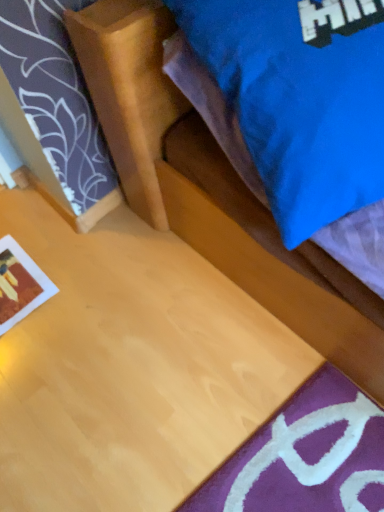
Locate an element on the screen. Image resolution: width=384 pixels, height=512 pixels. matte paper print at lower left is located at coordinates click(x=20, y=284).

What do you see at coordinates (20, 284) in the screenshot?
I see `matte paper print at lower left` at bounding box center [20, 284].

Measure the distance between matte paper print at lower left and camera.

The depth of matte paper print at lower left is 3.89 feet.

I want to click on matte blue pillow at upper right, so click(x=209, y=187).

Describe the element at coordinates (209, 187) in the screenshot. The height and width of the screenshot is (512, 384). I see `matte blue pillow at upper right` at that location.

This screenshot has width=384, height=512. I want to click on matte paper print at lower left, so click(20, 284).

Considering the positions of objects matte paper print at lower left and matte blue pillow at upper right in the image provided, who is more to the left, matte paper print at lower left or matte blue pillow at upper right?

From the viewer's perspective, matte paper print at lower left appears more on the left side.

Is matte paper print at lower left in front of or behind matte blue pillow at upper right in the image?

matte paper print at lower left is behind matte blue pillow at upper right.

Which point is more forward, (17,290) or (141,176)?

The point (141,176) is in front.

From the image's perspective, is matte paper print at lower left under matte blue pillow at upper right?

Indeed, from the image's perspective, matte paper print at lower left is shown beneath matte blue pillow at upper right.

From a real-world perspective, relative to matte blue pillow at upper right, is matte paper print at lower left vertically above or below?

Clearly, from a real-world perspective, matte paper print at lower left is below matte blue pillow at upper right.

Considering the sizes of objects matte paper print at lower left and matte blue pillow at upper right in the image provided, who is wider, matte paper print at lower left or matte blue pillow at upper right?

matte blue pillow at upper right is wider.

Who is shorter, matte paper print at lower left or matte blue pillow at upper right?

matte paper print at lower left.

Considering the sizes of matte paper print at lower left and matte blue pillow at upper right in the image, is matte paper print at lower left bigger or smaller than matte blue pillow at upper right?

Considering their sizes, matte paper print at lower left takes up less space than matte blue pillow at upper right.

Is matte paper print at lower left spatially inside matte blue pillow at upper right, or outside of it?

matte paper print at lower left exists outside the volume of matte blue pillow at upper right.

Would you say matte paper print at lower left is a long distance from matte blue pillow at upper right?

matte paper print at lower left is actually quite close to matte blue pillow at upper right.

Is matte paper print at lower left oriented away from matte blue pillow at upper right?

matte paper print at lower left does not have its back to matte blue pillow at upper right.

Looking at this image, can you tell me how much matte paper print at lower left and matte blue pillow at upper right differ in facing direction?

The angular difference between matte paper print at lower left and matte blue pillow at upper right is 8.06 degrees.

Where is `bed that is above the matte paper print at lower left (from the image's perspective)`? The image size is (384, 512). bed that is above the matte paper print at lower left (from the image's perspective) is located at coordinates (209, 187).

Can you confirm if matte blue pillow at upper right is positioned to the right of matte paper print at lower left?

Correct, you'll find matte blue pillow at upper right to the right of matte paper print at lower left.

Which is behind, matte blue pillow at upper right or matte paper print at lower left?

matte paper print at lower left.

In the scene shown: Which point is more forward, (139, 200) or (2, 310)?

The point (2, 310) is closer.

From the image's perspective, which one is positioned lower, matte blue pillow at upper right or matte paper print at lower left?

matte paper print at lower left, from the image's perspective.

From a real-world perspective, which is physically below, matte blue pillow at upper right or matte paper print at lower left?

matte paper print at lower left.

Between matte blue pillow at upper right and matte paper print at lower left, which one has smaller width?

Thinner between the two is matte paper print at lower left.

Considering the sizes of objects matte blue pillow at upper right and matte paper print at lower left in the image provided, who is shorter, matte blue pillow at upper right or matte paper print at lower left?

matte paper print at lower left is shorter.

Which of these two, matte blue pillow at upper right or matte paper print at lower left, is bigger?

Bigger between the two is matte blue pillow at upper right.

Would you say matte blue pillow at upper right is inside or outside matte paper print at lower left?

matte blue pillow at upper right is not inside matte paper print at lower left, it's outside.

Are matte blue pillow at upper right and matte paper print at lower left making contact?

matte blue pillow at upper right and matte paper print at lower left are not in contact.

Is matte paper print at lower left at the back of matte blue pillow at upper right?

No, matte blue pillow at upper right's orientation is not away from matte paper print at lower left.

What's the angular difference between matte blue pillow at upper right and matte paper print at lower left's facing directions?

Answer: The angle between the facing direction of matte blue pillow at upper right and the facing direction of matte paper print at lower left is 8.06 degrees.

Where is `print on the left of the matte blue pillow at upper right`? This screenshot has height=512, width=384. print on the left of the matte blue pillow at upper right is located at coordinates (20, 284).

Locate an element on the screen. The image size is (384, 512). print on the left of matte blue pillow at upper right is located at coordinates (20, 284).

What are the coordinates of `bed positioned vertically above the matte paper print at lower left (from a real-world perspective)` in the screenshot? It's located at (209, 187).